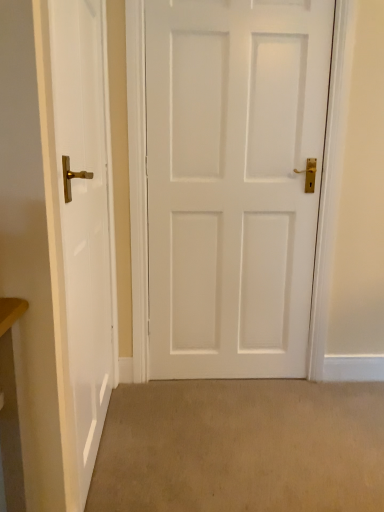
Where is `free region under white matte door at center, placed as the 1th door when sorted from right to left (from a real-world perspective)`? free region under white matte door at center, placed as the 1th door when sorted from right to left (from a real-world perspective) is located at coordinates (227, 384).